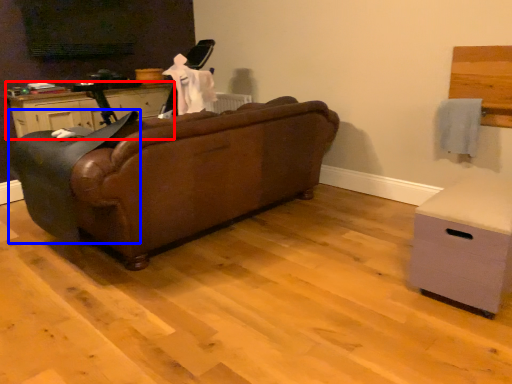
Question: Which object is closer to the camera taking this photo, cabinetry (highlighted by a red box) or rocking chair (highlighted by a blue box)?

Choices:
 (A) cabinetry
 (B) rocking chair

Answer: (B)